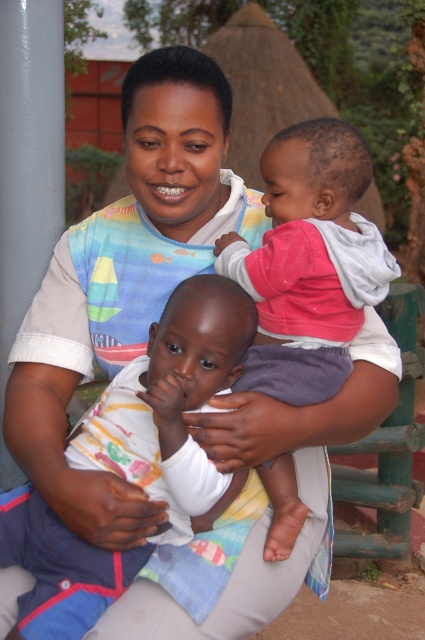
Question: Can you confirm if white cotton shirt at center is smaller than soft pink fabric at upper right?

Choices:
 (A) no
 (B) yes

Answer: (A)

Question: Is white cotton shirt at center to the right of soft pink fabric at upper right from the viewer's perspective?

Choices:
 (A) no
 (B) yes

Answer: (A)

Question: Can you confirm if white cotton shirt at center is wider than soft pink fabric at upper right?

Choices:
 (A) yes
 (B) no

Answer: (A)

Question: Which point is closer to the camera taking this photo?

Choices:
 (A) (280, 161)
 (B) (175, 444)

Answer: (B)